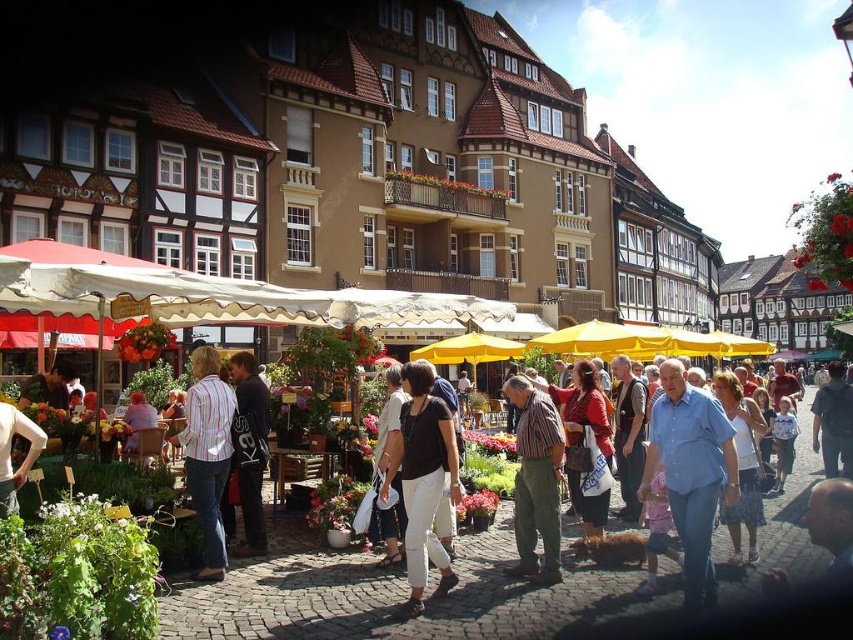
Can you confirm if light blue cotton shirt at center is bigger than striped cotton shirt at center?

No.

Can you confirm if light blue cotton shirt at center is thinner than striped cotton shirt at center?

Yes.

Where is `light blue cotton shirt at center`? This screenshot has width=853, height=640. light blue cotton shirt at center is located at coordinates (691, 472).

Locate an element on the screen. The height and width of the screenshot is (640, 853). light blue cotton shirt at center is located at coordinates (691, 472).

Does striped fabric shirt at center appear under dark gray hoodie at center?

Indeed, striped fabric shirt at center is positioned under dark gray hoodie at center.

Who is more forward, (509, 573) or (245, 538)?

Point (509, 573) is in front.

Locate an element on the screen. striped fabric shirt at center is located at coordinates (537, 481).

Does light blue cotton shirt at center appear over dark gray hoodie at center?

No.

Between light blue cotton shirt at center and dark gray hoodie at center, which one is positioned lower?

light blue cotton shirt at center is lower down.

Does point (688, 390) come behind point (256, 394)?

No, it is in front of (256, 394).

The height and width of the screenshot is (640, 853). In order to click on light blue cotton shirt at center in this screenshot , I will do (691, 472).